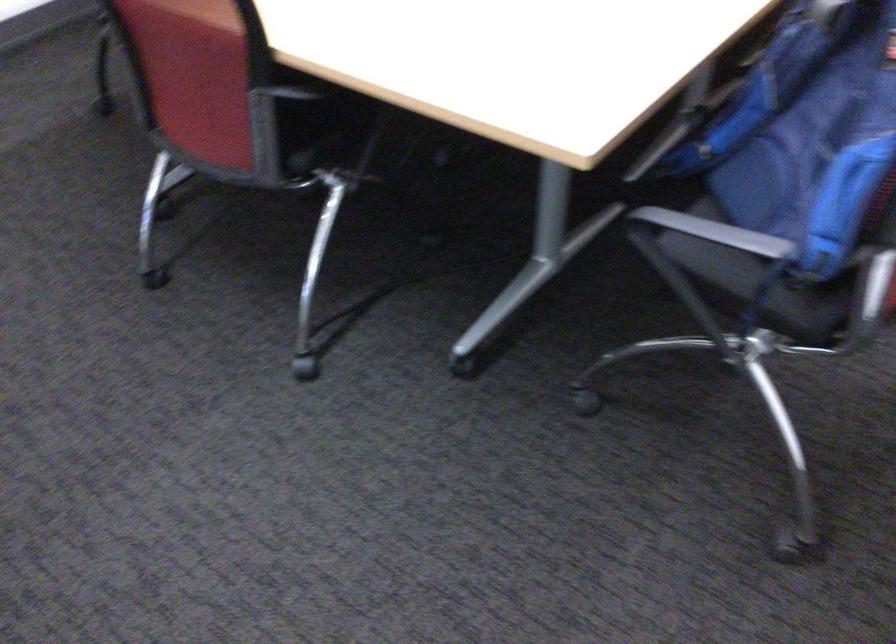
The width and height of the screenshot is (896, 644). What are the coordinates of `black chair armrest` in the screenshot? It's located at (716, 232).